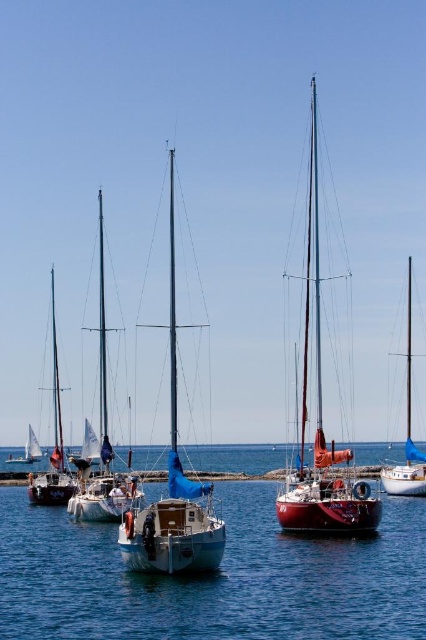
Question: Which point appears farthest from the camera in this image?

Choices:
 (A) (25, 616)
 (B) (416, 476)

Answer: (B)

Question: Which of the following is the closest to the observer?

Choices:
 (A) (42, 476)
 (B) (411, 481)
 (C) (339, 528)
 (D) (98, 204)

Answer: (C)

Question: Among these objects, which one is nearest to the camera?

Choices:
 (A) white matte sailboat at center
 (B) clear blue water at center

Answer: (B)

Question: Is clear blue water at center below white sailboat at left?

Choices:
 (A) yes
 (B) no

Answer: (B)

Question: Does clear blue water at center have a larger size compared to matte blue sailboat at center?

Choices:
 (A) no
 (B) yes

Answer: (A)

Question: Does clear blue water at center appear under matte blue sailboat at center?

Choices:
 (A) no
 (B) yes

Answer: (B)